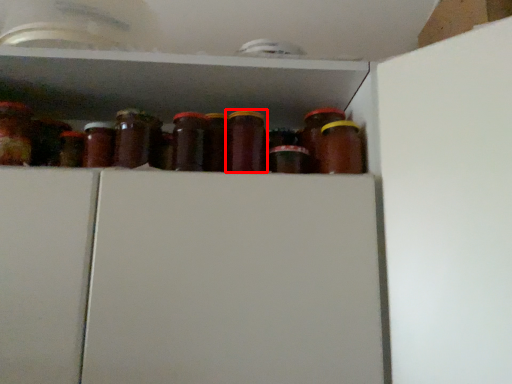
Question: From the image's perspective, what is the correct spatial relationship of bottle (annotated by the red box) in relation to bottle?

Choices:
 (A) above
 (B) below

Answer: (A)